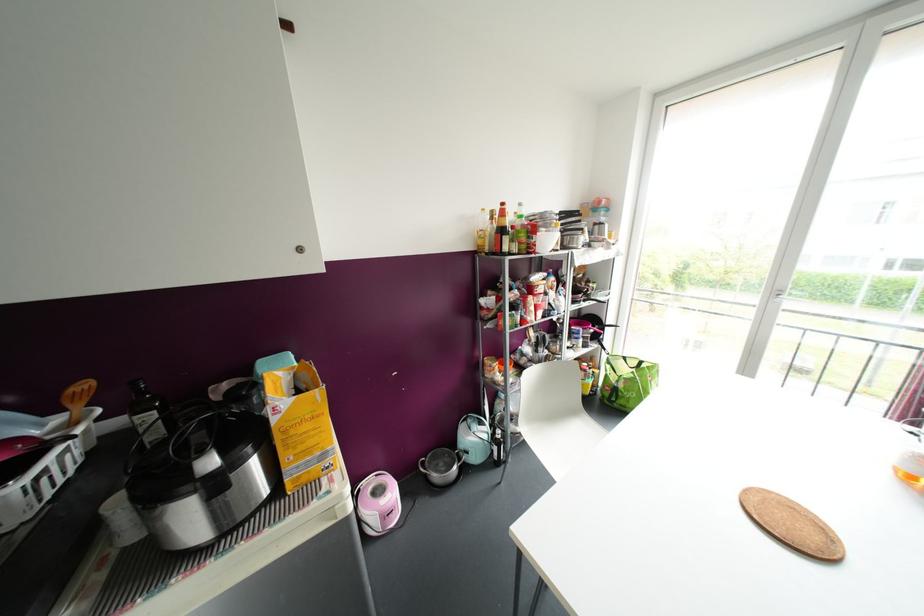
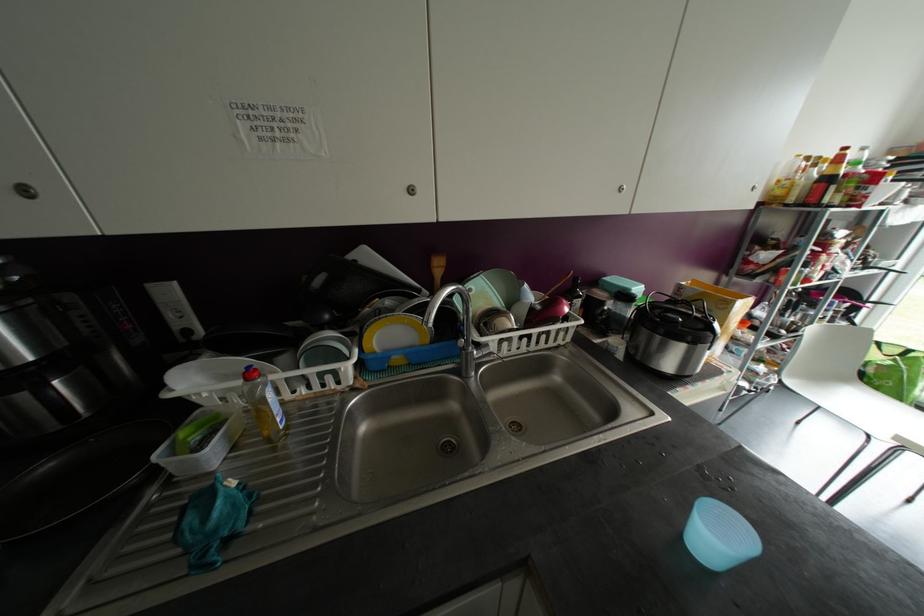
The images are taken continuously from a first-person perspective. In which direction are you moving?

The movement direction of the cameraman is left, backward.